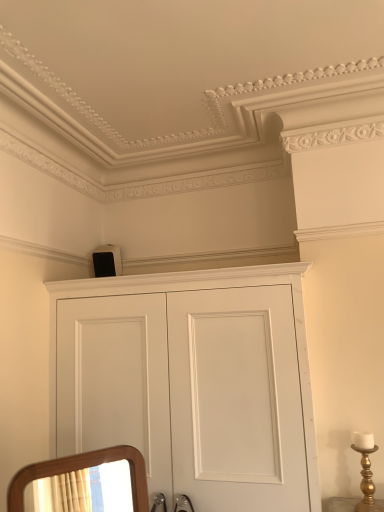
The image size is (384, 512). What do you see at coordinates (366, 472) in the screenshot? I see `gold metallic candle holder at right` at bounding box center [366, 472].

Find the location of a particular element. This screenshot has width=384, height=512. gold metallic candle holder at right is located at coordinates (366, 472).

This screenshot has width=384, height=512. What do you see at coordinates (107, 261) in the screenshot?
I see `white matte speaker at upper center` at bounding box center [107, 261].

Identify the location of gold metallic candle holder at right. (366, 472).

What's the angular difference between white matte speaker at upper center and gold metallic candle holder at right's facing directions?

0.146 degrees.

Visually, is white matte speaker at upper center positioned to the left or to the right of gold metallic candle holder at right?

In the image, white matte speaker at upper center appears on the left side of gold metallic candle holder at right.

Is white matte speaker at upper center facing away from gold metallic candle holder at right?

No, white matte speaker at upper center's orientation is not away from gold metallic candle holder at right.

Is white matte speaker at upper center far away from gold metallic candle holder at right?

Yes, white matte speaker at upper center and gold metallic candle holder at right are quite far apart.

Between white matte speaker at upper center and white matte cupboard at upper center, which one appears on the right side from the viewer's perspective?

Positioned to the right is white matte cupboard at upper center.

Do you think white matte speaker at upper center is within white matte cupboard at upper center, or outside of it?

white matte speaker at upper center cannot be found inside white matte cupboard at upper center.

Would you consider white matte speaker at upper center to be distant from white matte cupboard at upper center?

white matte speaker at upper center is actually quite close to white matte cupboard at upper center.

Is there a large distance between white matte cupboard at upper center and gold metallic candle holder at right?

white matte cupboard at upper center is actually quite close to gold metallic candle holder at right.

Between point (275, 473) and point (365, 492), which one is positioned behind?

Positioned behind is point (365, 492).

From a real-world perspective, is white matte cupboard at upper center under gold metallic candle holder at right?

No, from a real-world perspective, white matte cupboard at upper center is not below gold metallic candle holder at right.

Does white matte cupboard at upper center have a lesser height compared to gold metallic candle holder at right?

No, white matte cupboard at upper center is not shorter than gold metallic candle holder at right.

Is gold metallic candle holder at right facing towards white matte cupboard at upper center?

No, gold metallic candle holder at right is not oriented towards white matte cupboard at upper center.

Is point (364, 438) closer to viewer compared to point (306, 268)?

Yes, point (364, 438) is in front of point (306, 268).

Is gold metallic candle holder at right inside the boundaries of white matte cupboard at upper center, or outside?

gold metallic candle holder at right is outside white matte cupboard at upper center.

From the image's perspective, which one is positioned higher, white matte cupboard at upper center or white matte speaker at upper center?

white matte speaker at upper center appears higher in the image.

Which point is more forward, (305, 264) or (94, 256)?

Point (305, 264)

Locate an element on the screen. This screenshot has height=512, width=384. cupboard on the right of white matte speaker at upper center is located at coordinates (190, 382).

Which object is thinner, gold metallic candle holder at right or white matte speaker at upper center?

gold metallic candle holder at right.

From a real-world perspective, between gold metallic candle holder at right and white matte speaker at upper center, who is vertically lower?

gold metallic candle holder at right is physically lower.

Where is `candle holder on the right of white matte speaker at upper center`? candle holder on the right of white matte speaker at upper center is located at coordinates (366, 472).

Image resolution: width=384 pixels, height=512 pixels. Find the location of `cupboard lying in front of the white matte speaker at upper center`. cupboard lying in front of the white matte speaker at upper center is located at coordinates (190, 382).

When comparing their distances from white matte cupboard at upper center, does gold metallic candle holder at right or white matte speaker at upper center seem further?

white matte speaker at upper center.

From the image, which object appears to be farther from gold metallic candle holder at right, white matte cupboard at upper center or white matte speaker at upper center?

Based on the image, white matte speaker at upper center appears to be further to gold metallic candle holder at right.

Based on their spatial positions, is white matte speaker at upper center or white matte cupboard at upper center further from gold metallic candle holder at right?

white matte speaker at upper center is positioned further to the anchor gold metallic candle holder at right.

Based on their spatial positions, is gold metallic candle holder at right or white matte cupboard at upper center closer to white matte speaker at upper center?

white matte cupboard at upper center lies closer to white matte speaker at upper center than the other object.

Looking at this image, looking at the image, which one is located closer to white matte speaker at upper center, white matte cupboard at upper center or gold metallic candle holder at right?

Based on the image, white matte cupboard at upper center appears to be nearer to white matte speaker at upper center.

Looking at the image, which one is located closer to white matte cupboard at upper center, white matte speaker at upper center or gold metallic candle holder at right?

gold metallic candle holder at right is positioned closer to the anchor white matte cupboard at upper center.

The image size is (384, 512). In order to click on cupboard between white matte speaker at upper center and gold metallic candle holder at right in the horizontal direction in this screenshot , I will do `click(190, 382)`.